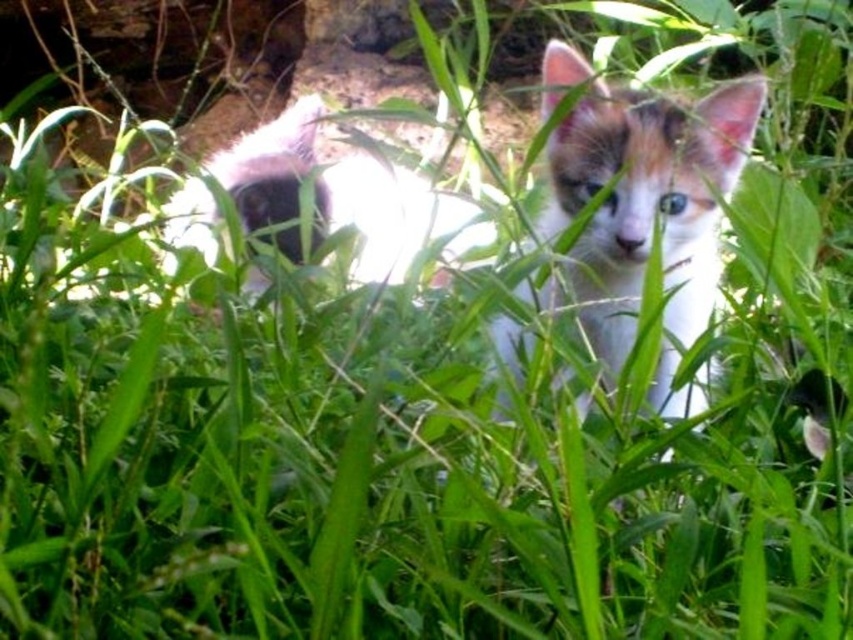
Who is more forward, (653, 141) or (260, 131)?

Positioned in front is point (653, 141).

Can you confirm if calico fur kitten at center is shorter than fluffy white cat at center?

Yes.

Is point (550, 148) positioned before point (281, 248)?

Yes, it is.

You are a GUI agent. You are given a task and a screenshot of the screen. Output one action in this format:
    pyautogui.click(x=<x>, y=<y>)
    Task: Click on the calico fur kitten at center
    
    Given the screenshot: What is the action you would take?
    pyautogui.click(x=647, y=202)